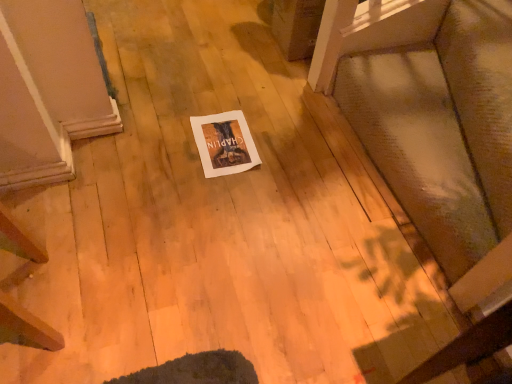
You are a GUI agent. You are given a task and a screenshot of the screen. Output one action in this format:
    pyautogui.click(x=<x>, y=<y>)
    Task: Click on the vacant space underneath white paper at center (from a real-world perspective)
    This screenshot has height=384, width=512.
    Given the screenshot: What is the action you would take?
    pyautogui.click(x=224, y=140)